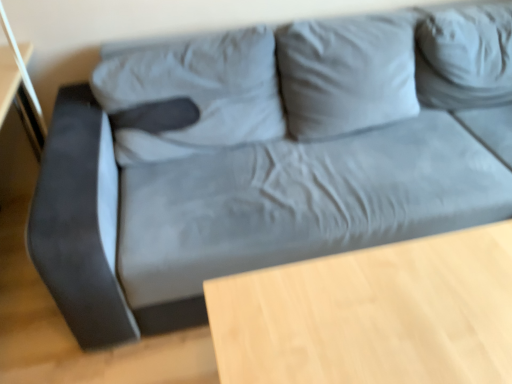
You are a GUI agent. You are given a task and a screenshot of the screen. Output one action in this format:
    pyautogui.click(x=<x>, y=<y>)
    Task: Click on the light wood table at lower right
    The height and width of the screenshot is (384, 512).
    Given the screenshot: What is the action you would take?
    pyautogui.click(x=372, y=314)

Describe the element at coordinates (372, 314) in the screenshot. I see `light wood table at lower right` at that location.

Image resolution: width=512 pixels, height=384 pixels. In order to click on light wood table at lower right in this screenshot , I will do `click(372, 314)`.